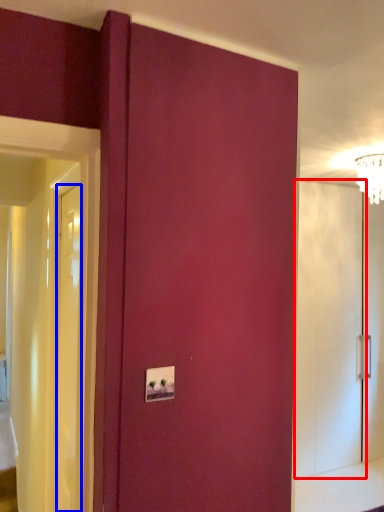
Question: Among these objects, which one is nearest to the camera, screen door (highlighted by a red box) or door (highlighted by a blue box)?

Choices:
 (A) screen door
 (B) door

Answer: (B)